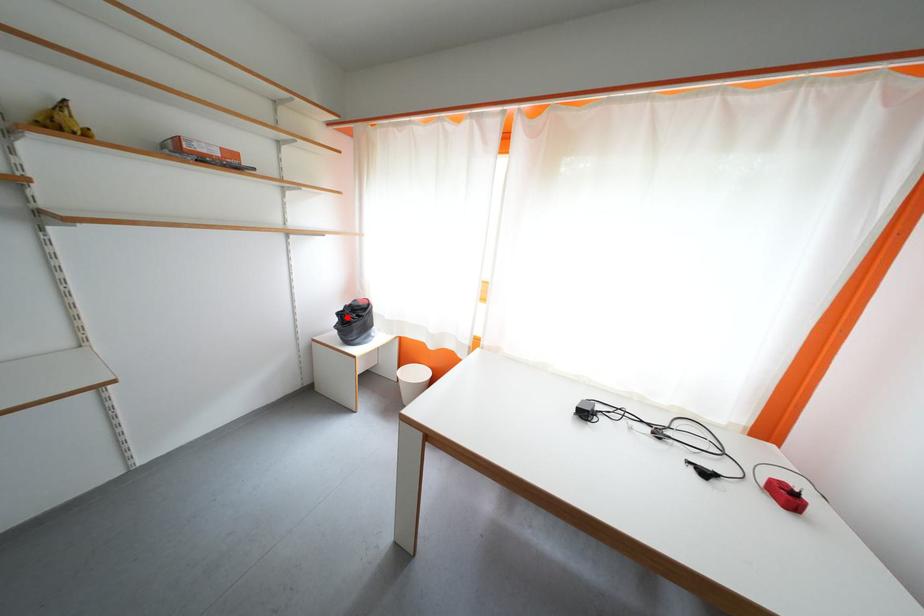
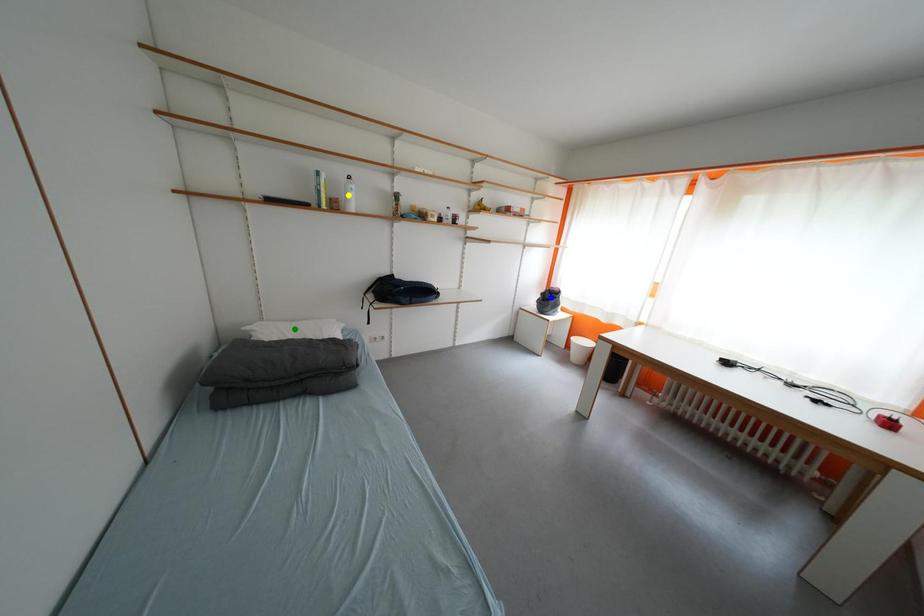
Question: I am providing you with two images of the same scene from different viewpoints. A red point is marked on the first image. You are given multiple points on the second image. Which mark in image 2 goes with the point in image 1?

Choices:
 (A) blue point
 (B) green point
 (C) yellow point

Answer: (A)